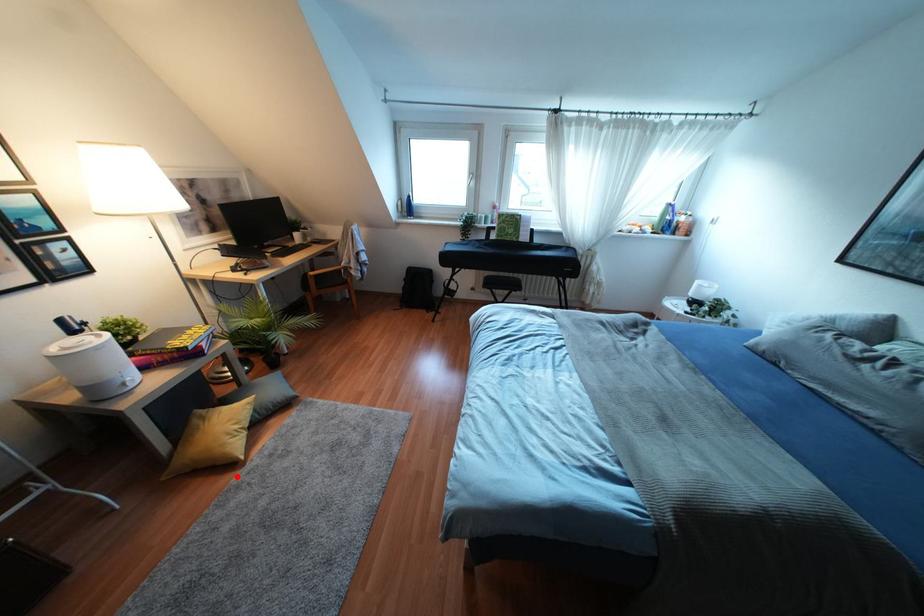
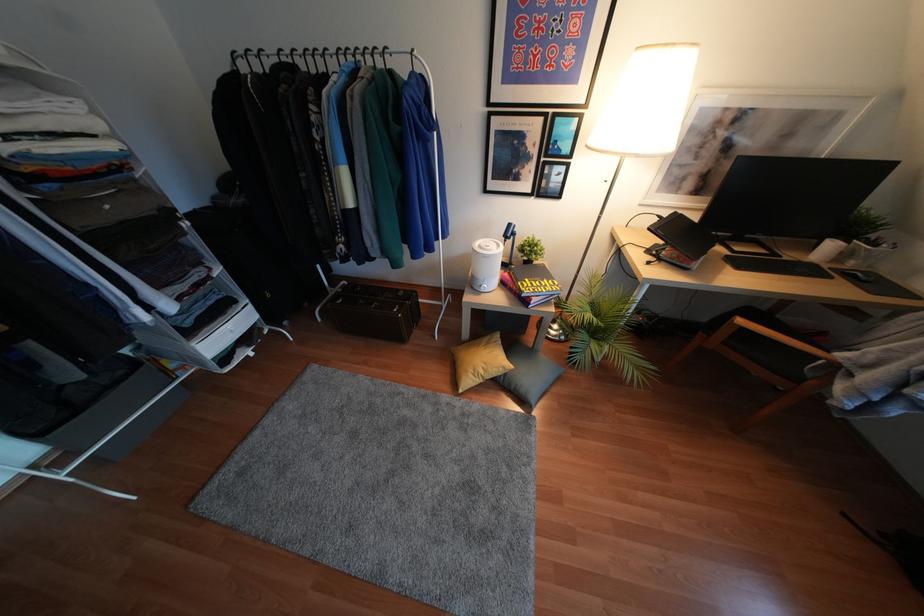
The point at the highlighted location is marked in the first image. Where is the corresponding point in the second image?

(445, 397)